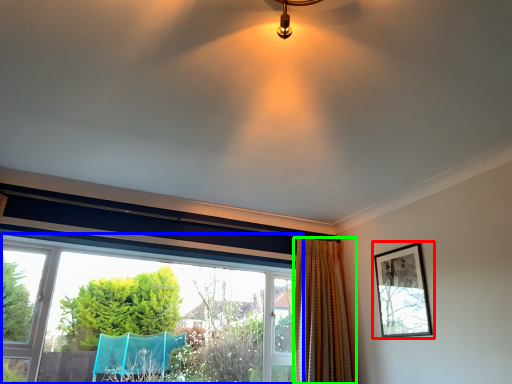
Question: Which object is the farthest from picture frame (highlighted by a red box)? Choose among these: window (highlighted by a blue box) or curtain (highlighted by a green box).

Choices:
 (A) window
 (B) curtain

Answer: (A)